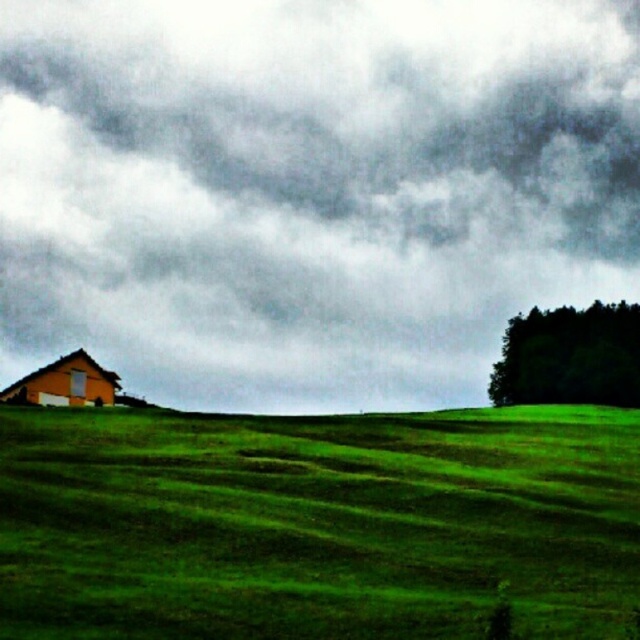
You are standing in the field and want to take a photo of the orange matte hut at left and the dark gray cloud at upper center. Which object should you point your camera towards first if you want to capture both in one frame?

You should point your camera towards the orange matte hut at left first because the dark gray cloud at upper center is to the right of it, so by centering the hut, the cloud will naturally be on the right side of the frame.

You are standing at the point with coordinates point (289,630) and want to walk towards the point with coordinates point (28,385). Which direction should you move relative to the image?

You should move towards the lower left direction relative to the image because point (28,385) is located lower and to the left of point (289,630).